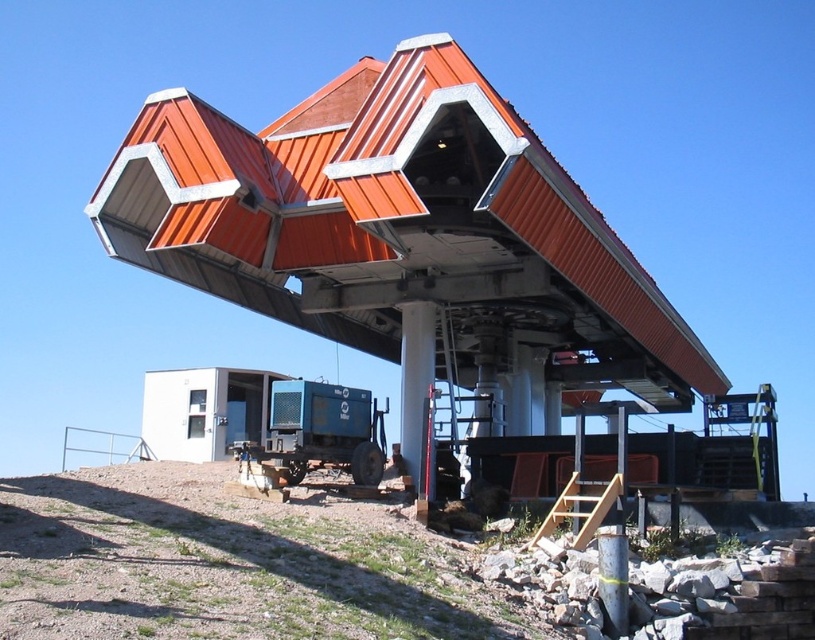
Between metallic orange roof at upper center and white smooth pillar at center, which one is positioned higher?

Positioned higher is metallic orange roof at upper center.

What do you see at coordinates (394, 220) in the screenshot? I see `metallic orange roof at upper center` at bounding box center [394, 220].

The width and height of the screenshot is (815, 640). Find the location of `metallic orange roof at upper center`. metallic orange roof at upper center is located at coordinates (394, 220).

Is metallic orange roof at upper center taller than blue metallic train car at lower center?

Indeed, metallic orange roof at upper center has a greater height compared to blue metallic train car at lower center.

Which is below, metallic orange roof at upper center or blue metallic train car at lower center?

blue metallic train car at lower center is below.

Who is more forward, (326, 276) or (368, 465)?

Point (368, 465) is in front.

In order to click on metallic orange roof at upper center in this screenshot , I will do `click(394, 220)`.

At what (x,y) coordinates should I click in order to perform the action: click on blue metallic train car at lower center. Please return your answer as a coordinate pair (x, y). The height and width of the screenshot is (640, 815). Looking at the image, I should click on 322,429.

Which is more to the right, blue metallic train car at lower center or white smooth pillar at center?

white smooth pillar at center is more to the right.

Is point (309, 392) farther from viewer compared to point (410, 316)?

That is False.

This screenshot has width=815, height=640. In order to click on blue metallic train car at lower center in this screenshot , I will do `click(322, 429)`.